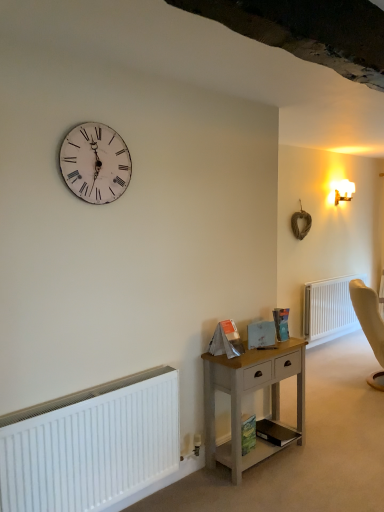
Locate an element on the screen. The height and width of the screenshot is (512, 384). free space in front of light wood nightstand at lower center is located at coordinates (269, 490).